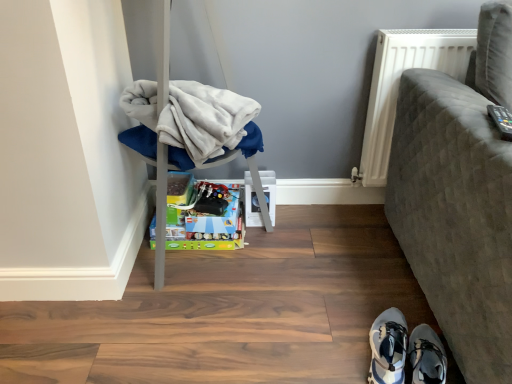
Question: Does textured gray sofa at right, which is counted as the second furniture, starting from the left, appear on the right side of light blue fabric shoe at lower right, the first footwear viewed from the left?

Choices:
 (A) no
 (B) yes

Answer: (B)

Question: Is textured gray sofa at right, which is counted as the second furniture, starting from the left, aimed at light blue fabric shoe at lower right, which is the 2th footwear from right to left?

Choices:
 (A) yes
 (B) no

Answer: (B)

Question: From the image's perspective, would you say textured gray sofa at right, which is counted as the second furniture, starting from the left, is shown under light blue fabric shoe at lower right, which is the 2th footwear from right to left?

Choices:
 (A) no
 (B) yes

Answer: (A)

Question: Is textured gray sofa at right, the 1th furniture positioned from the right, shorter than light blue fabric shoe at lower right, the first footwear viewed from the left?

Choices:
 (A) no
 (B) yes

Answer: (A)

Question: Is the position of textured gray sofa at right, the 1th furniture positioned from the right, more distant than that of light blue fabric shoe at lower right, which is the 2th footwear from right to left?

Choices:
 (A) yes
 (B) no

Answer: (B)

Question: In the image, is light blue fabric shoe at lower right, the first footwear viewed from the left, positioned in front of or behind white fleece blanket at left?

Choices:
 (A) behind
 (B) front

Answer: (B)

Question: Is light blue fabric shoe at lower right, the first footwear viewed from the left, taller or shorter than white fleece blanket at left?

Choices:
 (A) tall
 (B) short

Answer: (B)

Question: Is light blue fabric shoe at lower right, the first footwear viewed from the left, inside the boundaries of white fleece blanket at left, or outside?

Choices:
 (A) outside
 (B) inside

Answer: (A)

Question: Based on their positions, is light blue fabric shoe at lower right, the first footwear viewed from the left, located to the left or right of white fleece blanket at left?

Choices:
 (A) left
 (B) right

Answer: (B)

Question: In terms of width, does white synthetic sneakers at lower right, the second footwear positioned from the left, look wider or thinner when compared to white textured radiator at upper right?

Choices:
 (A) wide
 (B) thin

Answer: (A)

Question: Is white synthetic sneakers at lower right, which is the 1th footwear in right-to-left order, inside or outside of white textured radiator at upper right?

Choices:
 (A) outside
 (B) inside

Answer: (A)

Question: Is point (432, 344) positioned closer to the camera than point (370, 150)?

Choices:
 (A) closer
 (B) farther

Answer: (A)

Question: From a real-world perspective, is white synthetic sneakers at lower right, which is the 1th footwear in right-to-left order, physically located above or below white textured radiator at upper right?

Choices:
 (A) below
 (B) above

Answer: (A)

Question: From the image's perspective, is white fleece blanket at left positioned above or below shiny metallic toy at center?

Choices:
 (A) above
 (B) below

Answer: (A)

Question: Considering the positions of white fleece blanket at left and shiny metallic toy at center in the image, is white fleece blanket at left taller or shorter than shiny metallic toy at center?

Choices:
 (A) tall
 (B) short

Answer: (A)